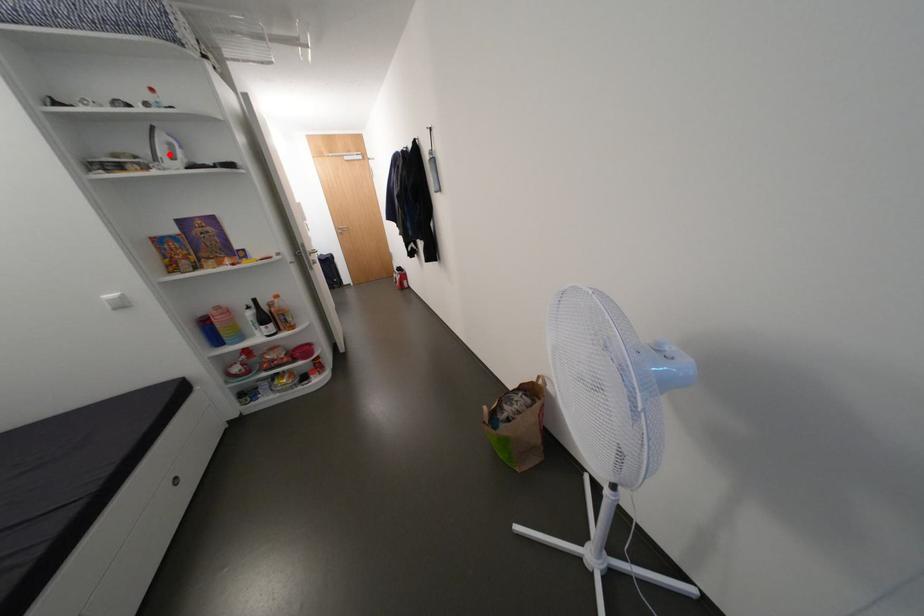
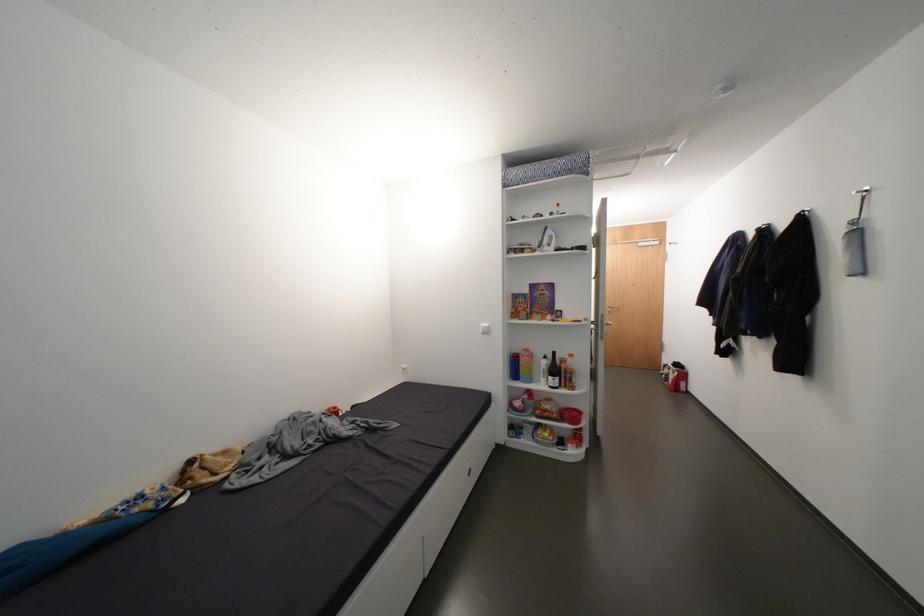
Locate, in the second image, the point that corresponds to the highlighted location in the first image.

(553, 243)